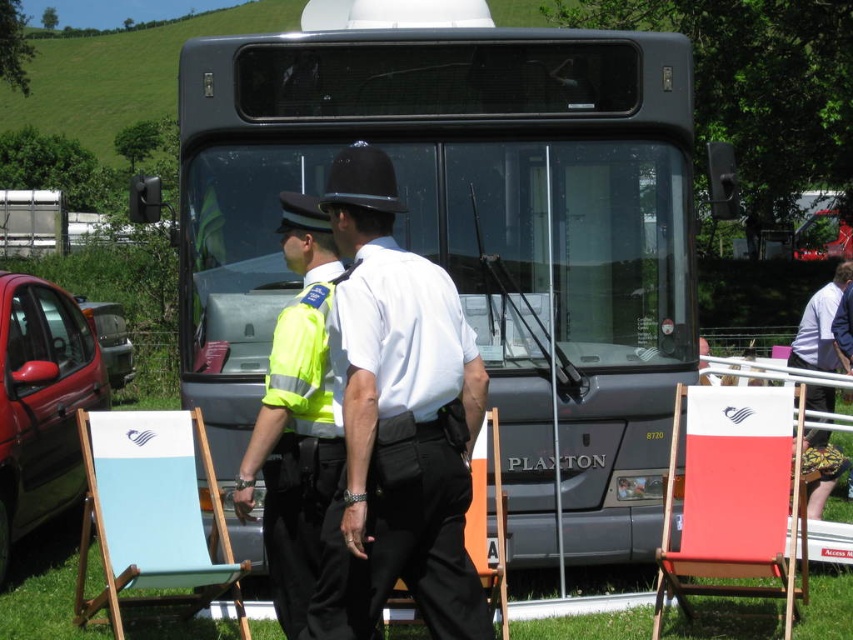
Does white glossy shirt at center have a greater width compared to high-visibility fabric safety vest at center?

Indeed, white glossy shirt at center has a greater width compared to high-visibility fabric safety vest at center.

Is white glossy shirt at center above high-visibility fabric safety vest at center?

No.

Is point (361, 316) less distant than point (293, 336)?

That is True.

Identify the location of white glossy shirt at center. (401, 413).

Is metallic gray bus at center to the left of high-visibility fabric safety vest at center from the viewer's perspective?

In fact, metallic gray bus at center is to the right of high-visibility fabric safety vest at center.

Locate an element on the screen. metallic gray bus at center is located at coordinates (469, 237).

How distant is metallic gray bus at center from white shirt at right?

metallic gray bus at center and white shirt at right are 2.51 meters apart from each other.

Who is shorter, metallic gray bus at center or white shirt at right?

Standing shorter between the two is white shirt at right.

Where is `metallic gray bus at center`? This screenshot has width=853, height=640. metallic gray bus at center is located at coordinates (469, 237).

This screenshot has width=853, height=640. I want to click on metallic gray bus at center, so click(469, 237).